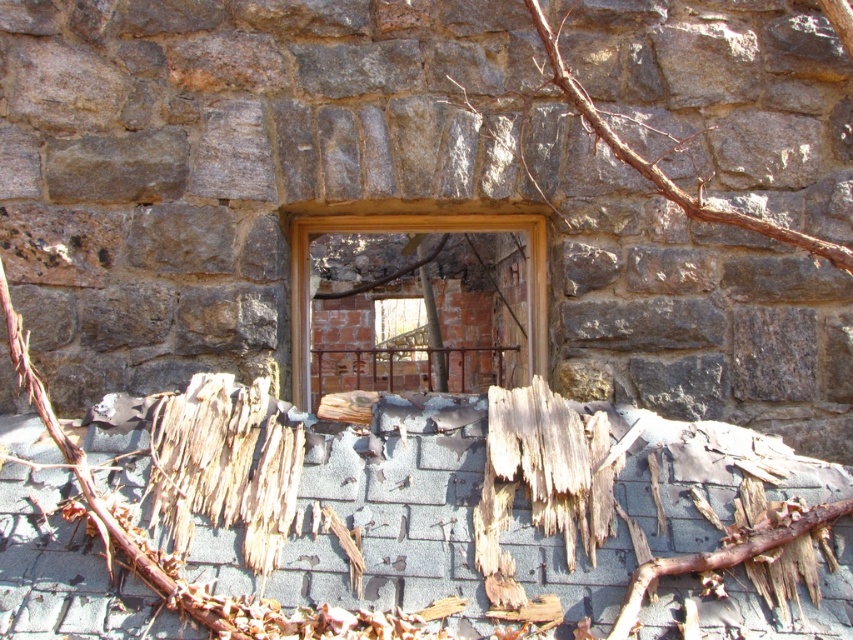
You are standing outside the building and looking at the stone wall with the window. There is brown shredded wood at lower left and brown woody branch at upper center. Which object is closer to you?

The brown shredded wood at lower left is closer to you because it is positioned under the brown woody branch at upper center, meaning it is in a lower position and thus nearer in the visual perspective.

You are standing outside the building looking at the stone wall with the window. You see a brown woody branch at upper center and a brown rough wood at lower center. Which object is positioned higher?

The brown woody branch at upper center is positioned higher than the brown rough wood at lower center.